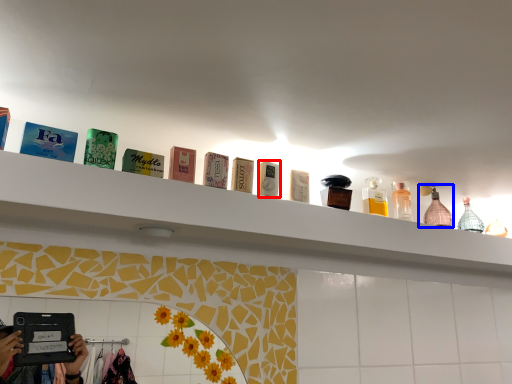
Question: Which object appears closest to the camera in this image, product (highlighted by a red box) or mouthwash (highlighted by a blue box)?

Choices:
 (A) product
 (B) mouthwash

Answer: (A)